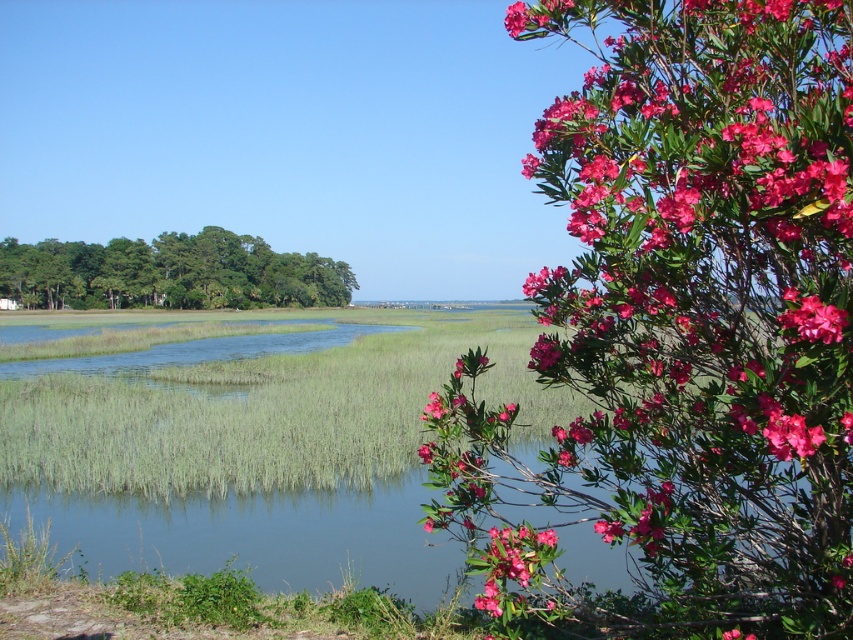
Is green leafy trees at left positioned at the back of pink matte flower at upper right?

That is True.

Does green leafy trees at left have a larger size compared to pink matte flower at upper right?

Correct, green leafy trees at left is larger in size than pink matte flower at upper right.

Between point (36, 256) and point (524, 586), which one is positioned in front?

Point (524, 586) is in front.

Find the location of a particular element. The width and height of the screenshot is (853, 640). green leafy trees at left is located at coordinates (169, 273).

Does pink glossy flowers at upper right appear on the left side of green leafy trees at left?

Incorrect, pink glossy flowers at upper right is not on the left side of green leafy trees at left.

Can you confirm if pink glossy flowers at upper right is bigger than green leafy trees at left?

Yes.

Does point (840, 358) come in front of point (114, 252)?

Yes, point (840, 358) is closer to viewer.

I want to click on pink glossy flowers at upper right, so click(683, 326).

How much distance is there between pink glossy flowers at upper right and pink matte flower at upper right?

The distance of pink glossy flowers at upper right from pink matte flower at upper right is 15.89 feet.

Between point (813, 131) and point (503, 532), which one is positioned behind?

Point (503, 532)

Who is more distant from viewer, (x=645, y=168) or (x=496, y=605)?

Positioned behind is point (x=496, y=605).

Identify the location of pink glossy flowers at upper right. (683, 326).